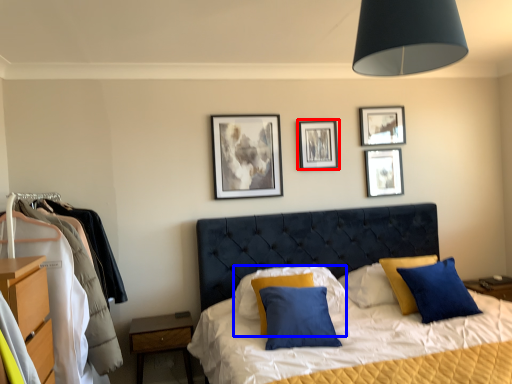
Question: Which object appears farthest to the camera in this image, picture frame (highlighted by a red box) or pillow (highlighted by a blue box)?

Choices:
 (A) picture frame
 (B) pillow

Answer: (A)